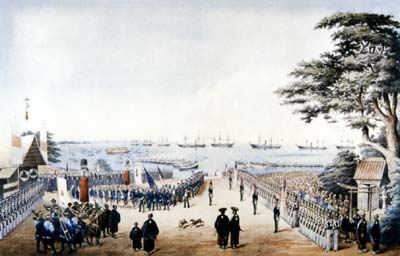
I want to click on robes, so click(x=132, y=233), click(x=149, y=233), click(x=223, y=232), click(x=233, y=230).